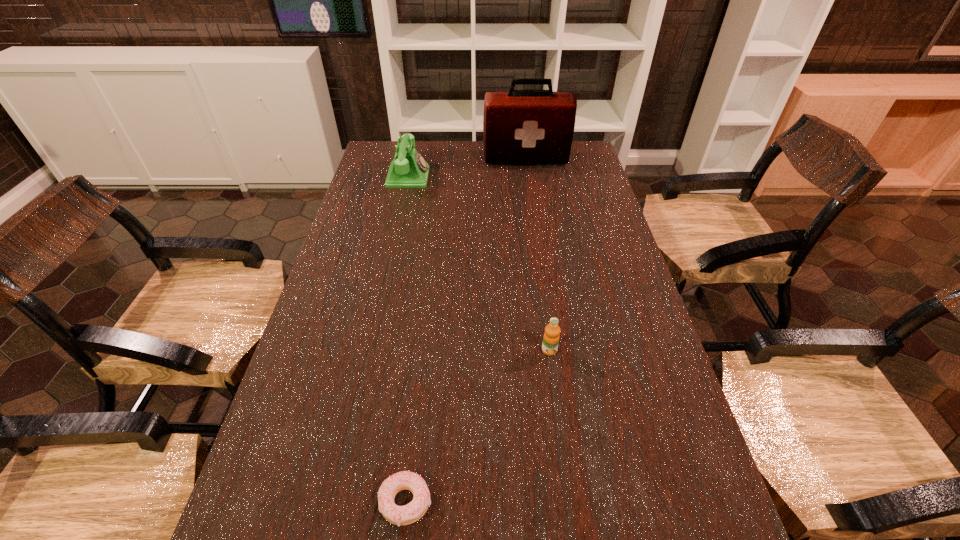
The height and width of the screenshot is (540, 960). I want to click on vacant space located on the left of the nearest object, so click(x=348, y=502).

The image size is (960, 540). What are the coordinates of `the first aid kit at the far edge` in the screenshot? It's located at (519, 126).

Locate an element on the screen. This screenshot has width=960, height=540. telephone present at the far edge is located at coordinates (408, 169).

This screenshot has height=540, width=960. What are the coordinates of `object located in the left edge section of the desktop` in the screenshot? It's located at (408, 169).

Locate an element on the screen. The image size is (960, 540). object located at the right edge is located at coordinates (519, 126).

The image size is (960, 540). In order to click on object located in the far left corner section of the desktop in this screenshot , I will do `click(408, 169)`.

Locate an element on the screen. object that is at the far right corner is located at coordinates (519, 126).

Image resolution: width=960 pixels, height=540 pixels. Find the location of `free space at the far edge of the desktop`. free space at the far edge of the desktop is located at coordinates pyautogui.click(x=465, y=155).

In the image, there is a desktop. Where is `vacant space at the left edge`? vacant space at the left edge is located at coordinates [x=365, y=176].

At what (x,y) coordinates should I click in order to perform the action: click on vacant space at the right edge of the desktop. Please return your answer as a coordinate pair (x, y). Looking at the image, I should click on (580, 270).